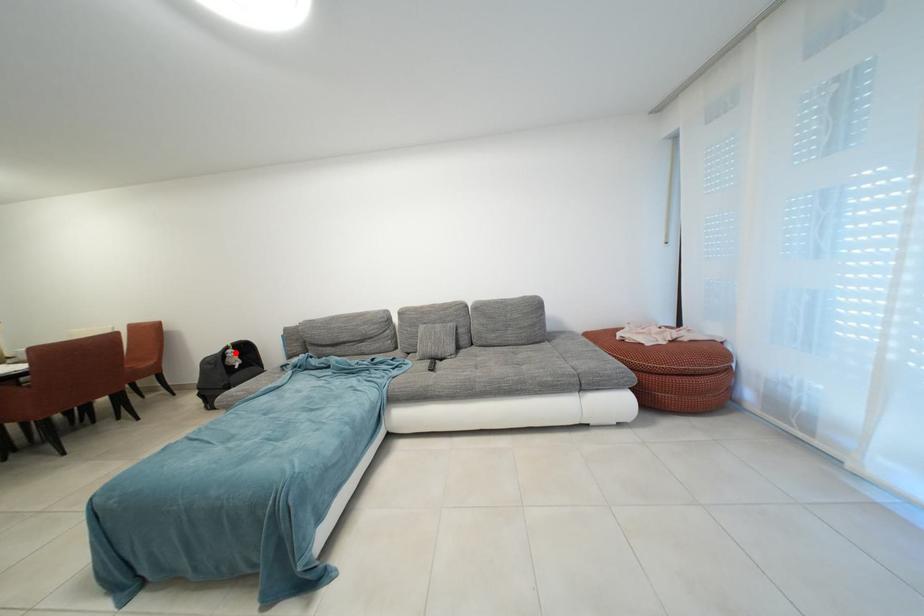
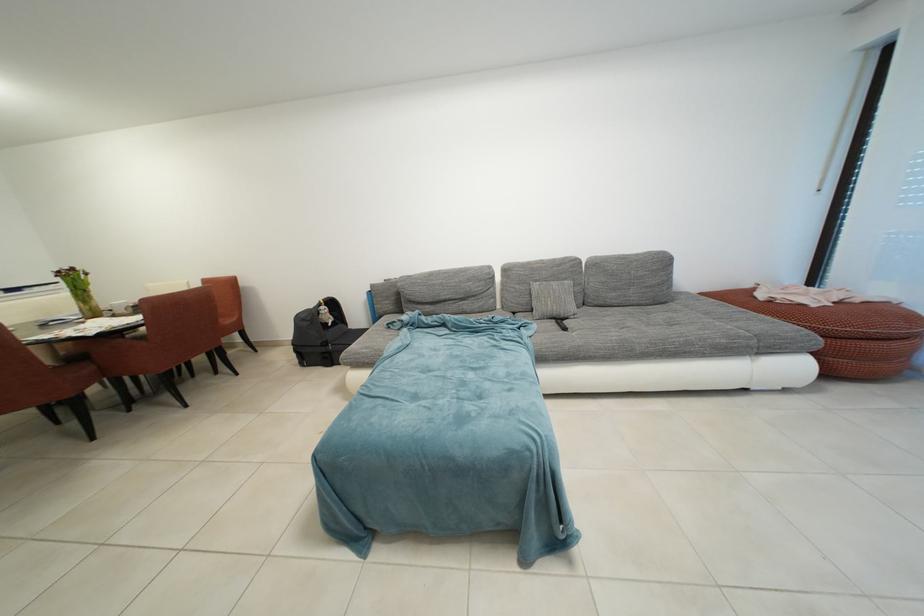
Question: I am providing you with two images of the same scene from different viewpoints. In image1, a red point is highlighted. Considering the same 3D point in image2, which of the following is correct?

Choices:
 (A) It is closer
 (B) It is farther

Answer: (A)